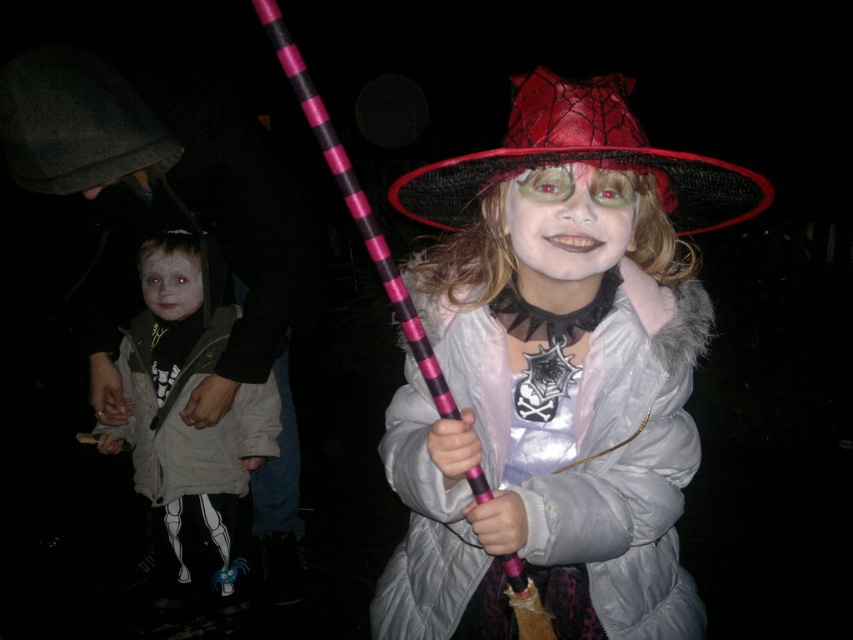
Can you confirm if matte black face at center is positioned to the left of pale skin at center?

Incorrect, matte black face at center is not on the left side of pale skin at center.

What do you see at coordinates (569, 220) in the screenshot?
I see `matte black face at center` at bounding box center [569, 220].

The width and height of the screenshot is (853, 640). I want to click on matte black face at center, so click(569, 220).

You are a GUI agent. You are given a task and a screenshot of the screen. Output one action in this format:
    pyautogui.click(x=<x>, y=<y>)
    Task: Click on the matte black face at center
    This screenshot has height=640, width=853.
    Given the screenshot: What is the action you would take?
    pyautogui.click(x=569, y=220)

Does white skeleton-patterned pants at lower left appear over pale skin at center?

No.

Can you confirm if white skeleton-patterned pants at lower left is positioned to the right of pale skin at center?

No, white skeleton-patterned pants at lower left is not to the right of pale skin at center.

Where is `white skeleton-patterned pants at lower left`? The width and height of the screenshot is (853, 640). white skeleton-patterned pants at lower left is located at coordinates (186, 424).

Between matte pink wand at center and red mesh witch hat at center, which one is positioned higher?

red mesh witch hat at center is higher up.

Is point (624, 371) farther from camera compared to point (550, 122)?

Yes, point (624, 371) is behind point (550, 122).

What are the coordinates of `matte pink wand at center` in the screenshot? It's located at (x=555, y=371).